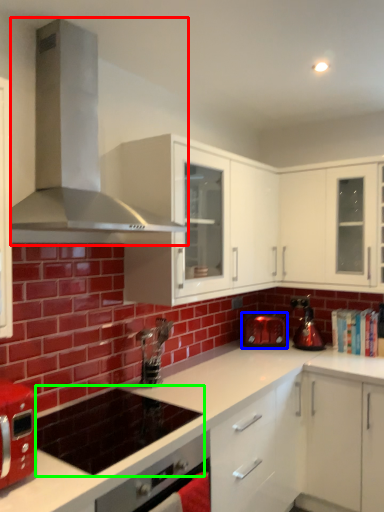
Question: Based on their relative distances, which object is farther from home appliance (highlighted by a red box)? Choose from kitchen appliance (highlighted by a blue box) and appliance (highlighted by a green box).

Choices:
 (A) kitchen appliance
 (B) appliance

Answer: (A)